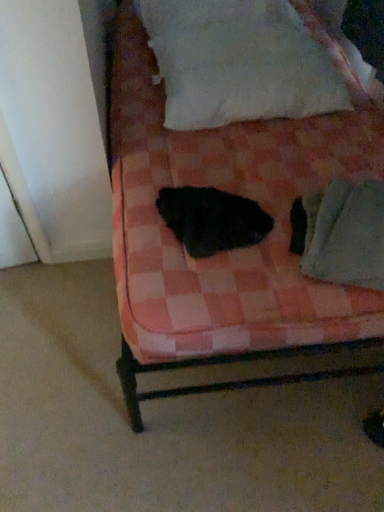
Question: Does black fuzzy cat at center have a greater height compared to green fabric at lower right?

Choices:
 (A) yes
 (B) no

Answer: (B)

Question: Can you confirm if black fuzzy cat at center is wider than green fabric at lower right?

Choices:
 (A) no
 (B) yes

Answer: (A)

Question: Does black fuzzy cat at center have a smaller size compared to green fabric at lower right?

Choices:
 (A) yes
 (B) no

Answer: (A)

Question: Would you say black fuzzy cat at center contains green fabric at lower right?

Choices:
 (A) no
 (B) yes

Answer: (A)

Question: Is green fabric at lower right at the back of black fuzzy cat at center?

Choices:
 (A) no
 (B) yes

Answer: (A)

Question: Considering the positions of point (352, 282) and point (268, 4), is point (352, 282) closer or farther from the camera than point (268, 4)?

Choices:
 (A) farther
 (B) closer

Answer: (B)

Question: Considering their positions, is green fabric at lower right located in front of or behind white cotton pillow at upper center?

Choices:
 (A) front
 (B) behind

Answer: (A)

Question: Is green fabric at lower right spatially inside white cotton pillow at upper center, or outside of it?

Choices:
 (A) inside
 (B) outside

Answer: (B)

Question: Considering the positions of green fabric at lower right and white cotton pillow at upper center in the image, is green fabric at lower right taller or shorter than white cotton pillow at upper center?

Choices:
 (A) short
 (B) tall

Answer: (A)

Question: Is white cotton pillow at upper center in front of or behind pink checkered fabric at center in the image?

Choices:
 (A) front
 (B) behind

Answer: (B)

Question: Is point (187, 9) positioned closer to the camera than point (196, 329)?

Choices:
 (A) farther
 (B) closer

Answer: (A)

Question: In terms of width, does white cotton pillow at upper center look wider or thinner when compared to pink checkered fabric at center?

Choices:
 (A) thin
 (B) wide

Answer: (A)

Question: Based on their sizes in the image, would you say white cotton pillow at upper center is bigger or smaller than pink checkered fabric at center?

Choices:
 (A) small
 (B) big

Answer: (A)

Question: Do you think pink checkered fabric at center is within black fuzzy cat at center, or outside of it?

Choices:
 (A) inside
 (B) outside

Answer: (B)

Question: In the image, is pink checkered fabric at center on the left side or the right side of black fuzzy cat at center?

Choices:
 (A) right
 (B) left

Answer: (A)